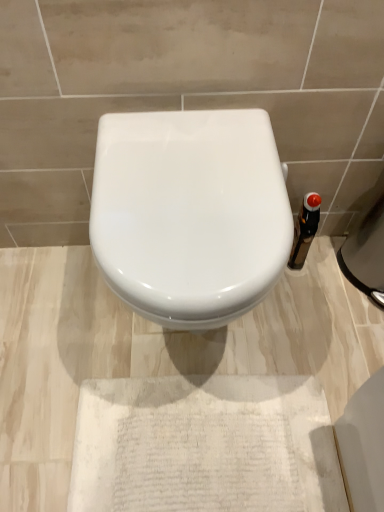
Question: Choose the correct answer: Is black glass bottle at right inside white glossy toilet at center or outside it?

Choices:
 (A) inside
 (B) outside

Answer: (B)

Question: From a real-world perspective, is black glass bottle at right physically located above or below white glossy toilet at center?

Choices:
 (A) above
 (B) below

Answer: (B)

Question: Considering the positions of black glass bottle at right and white glossy toilet at center in the image, is black glass bottle at right taller or shorter than white glossy toilet at center?

Choices:
 (A) short
 (B) tall

Answer: (A)

Question: Considering the positions of white glossy toilet at center and black glass bottle at right in the image, is white glossy toilet at center wider or thinner than black glass bottle at right?

Choices:
 (A) thin
 (B) wide

Answer: (B)

Question: Based on their sizes in the image, would you say white glossy toilet at center is bigger or smaller than black glass bottle at right?

Choices:
 (A) big
 (B) small

Answer: (A)

Question: In terms of height, does white glossy toilet at center look taller or shorter compared to black glass bottle at right?

Choices:
 (A) tall
 (B) short

Answer: (A)

Question: Which is correct: white glossy toilet at center is inside black glass bottle at right, or outside of it?

Choices:
 (A) outside
 (B) inside

Answer: (A)